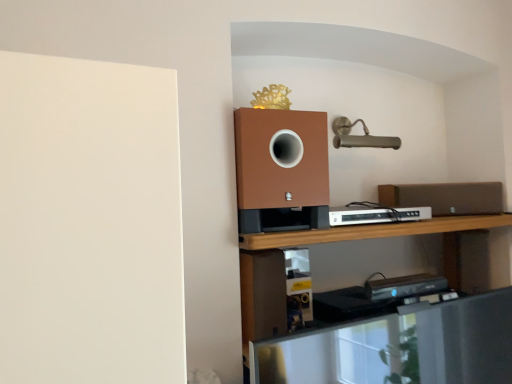
Question: Do you think brown matte speaker at right is within white plastic dvd player at center, or outside of it?

Choices:
 (A) inside
 (B) outside

Answer: (B)

Question: In terms of width, does brown matte speaker at right look wider or thinner when compared to white plastic dvd player at center?

Choices:
 (A) wide
 (B) thin

Answer: (B)

Question: Which object is the closest to the brown matte speaker at right?

Choices:
 (A) white plastic dvd player at center
 (B) metallic silver shelf at lower center

Answer: (A)

Question: Which is nearer to the brown matte speaker at right?

Choices:
 (A) metallic silver shelf at lower center
 (B) white plastic dvd player at center

Answer: (B)